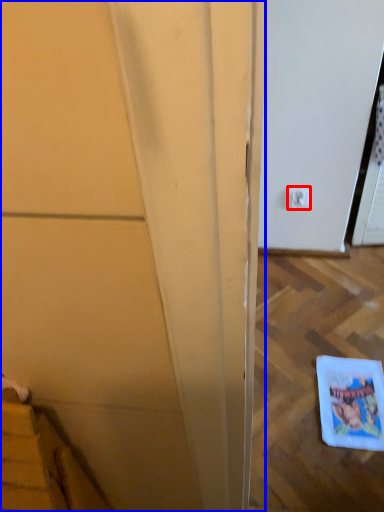
Question: Which of the following is the farthest to the observer, electric outlet (highlighted by a red box) or door (highlighted by a blue box)?

Choices:
 (A) electric outlet
 (B) door

Answer: (A)